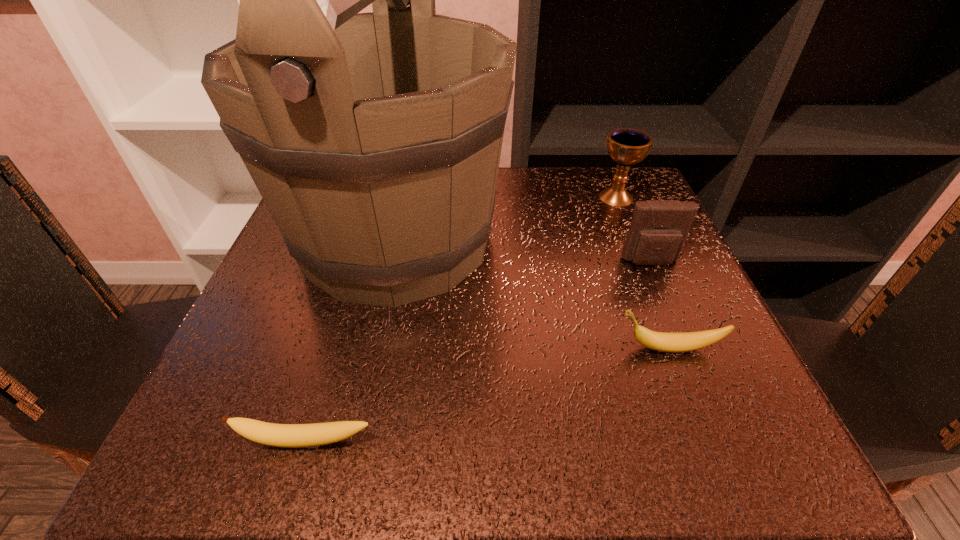
The width and height of the screenshot is (960, 540). I want to click on free location located 0.120m at the stem of the right banana, so click(537, 348).

At what (x,y) coordinates should I click in order to perform the action: click on free space located 0.240m at the stem of the right banana. Please return your answer as a coordinate pair (x, y). Looking at the image, I should click on click(x=460, y=348).

This screenshot has height=540, width=960. Identify the location of free point located 0.380m at the stem of the right banana. (369, 348).

Where is `bucket at the far edge`? bucket at the far edge is located at coordinates (374, 139).

At what (x,y) coordinates should I click in order to perform the action: click on chalice that is at the far edge. Please return your answer as a coordinate pair (x, y). Looking at the image, I should click on (626, 146).

Identify the location of object that is at the near edge. (279, 435).

I want to click on bucket that is at the left edge, so 374,139.

Where is `banana that is at the left edge`? The image size is (960, 540). banana that is at the left edge is located at coordinates (x=279, y=435).

Identify the location of chalice that is at the right edge. Image resolution: width=960 pixels, height=540 pixels. (626, 146).

This screenshot has height=540, width=960. I want to click on pouch present at the right edge, so click(x=659, y=228).